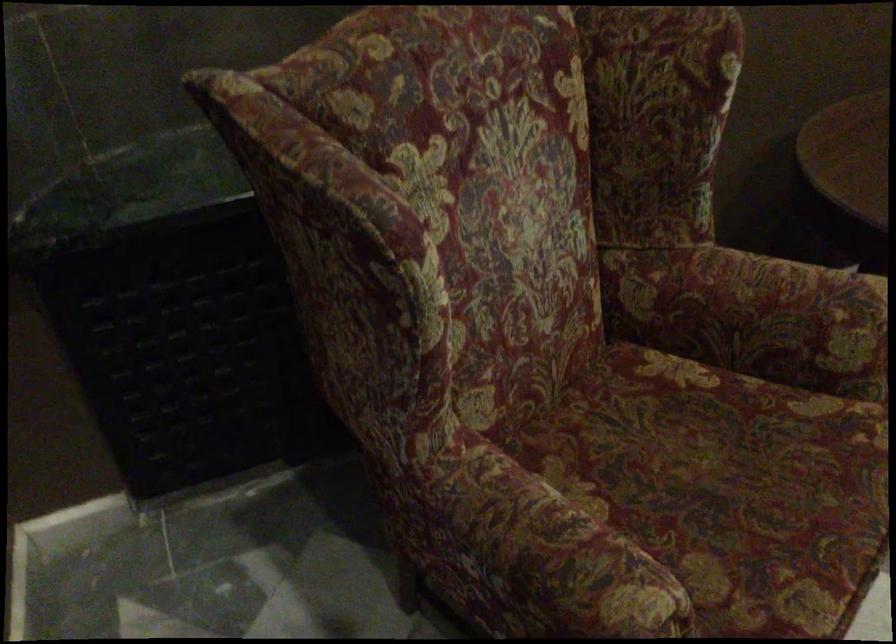
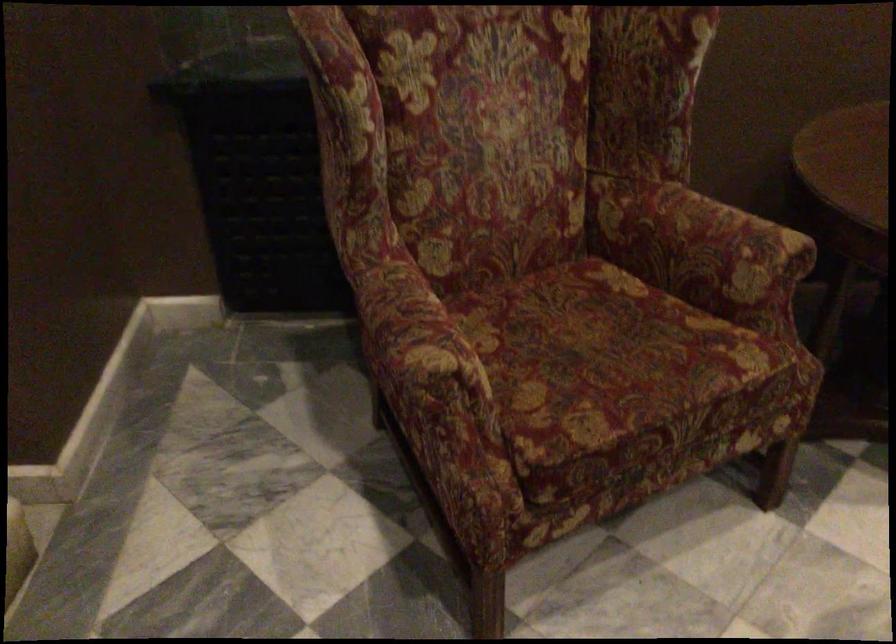
Where in the second image is the point corresponding to (x=752, y=493) from the first image?

(606, 361)